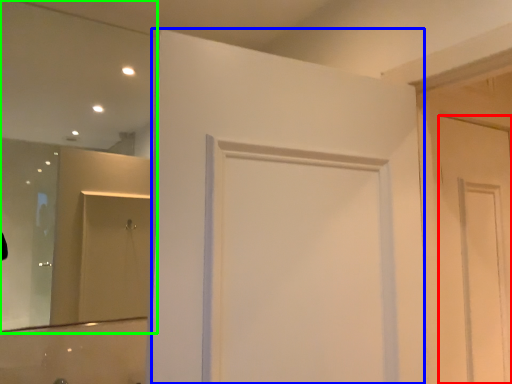
Question: Based on their relative distances, which object is farther from door (highlighted by a red box)? Choose from door (highlighted by a blue box) and mirror (highlighted by a green box).

Choices:
 (A) door
 (B) mirror

Answer: (B)